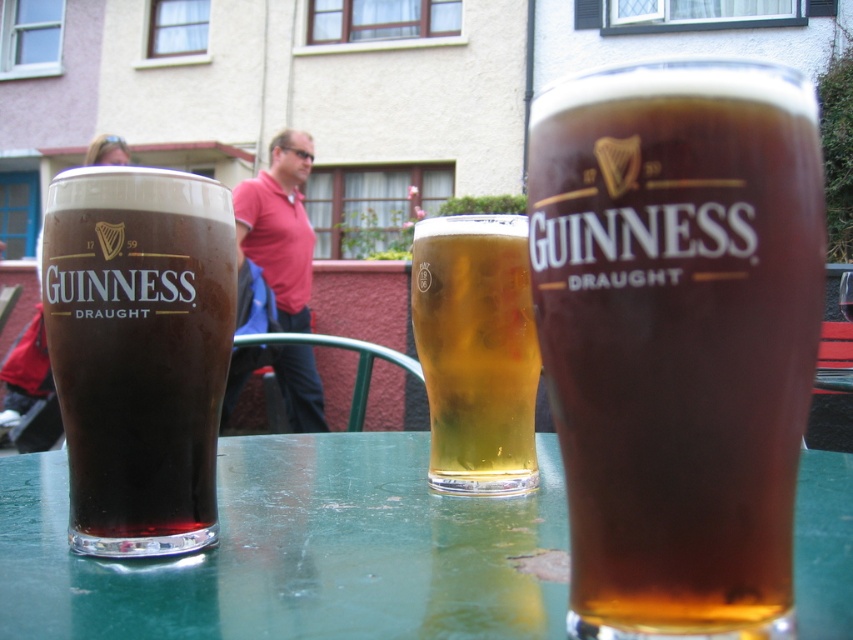
Question: Where is green glossy table at center located in relation to golden amber glass at center in the image?

Choices:
 (A) right
 (B) left

Answer: (A)

Question: Is dark brown glass at center further to the viewer compared to pink fabric shirt at center?

Choices:
 (A) no
 (B) yes

Answer: (A)

Question: Which point is farther to the camera?

Choices:
 (A) pink fabric shirt at center
 (B) dark brown glass at left

Answer: (A)

Question: Which point is farther to the camera?

Choices:
 (A) dark brown glass at center
 (B) dark brown glass at left

Answer: (B)

Question: Estimate the real-world distances between objects in this image. Which object is closer to the dark brown glass at left?

Choices:
 (A) green glossy table at center
 (B) golden amber glass at center

Answer: (B)

Question: In this image, where is green glossy table at center located relative to pink fabric shirt at center?

Choices:
 (A) below
 (B) above

Answer: (A)